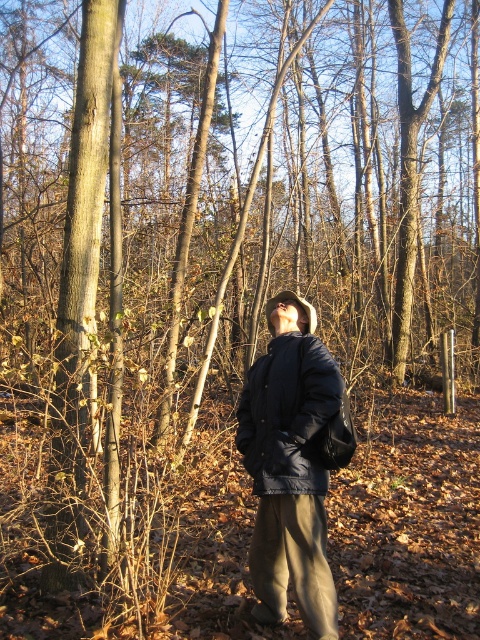
Who is lower down, matte black jacket at center or smooth brown bark at center?

matte black jacket at center is below.

Does matte black jacket at center have a greater height compared to smooth brown bark at center?

No, matte black jacket at center is not taller than smooth brown bark at center.

Describe the element at coordinates (289, 465) in the screenshot. The height and width of the screenshot is (640, 480). I see `matte black jacket at center` at that location.

I want to click on matte black jacket at center, so click(x=289, y=465).

Is smooth brown bark at center in front of navy blue quilted jacket at center?

No, it is not.

Does smooth brown bark at center appear over navy blue quilted jacket at center?

Indeed, smooth brown bark at center is positioned over navy blue quilted jacket at center.

Is point (59, 481) in front of point (300, 344)?

That is False.

What are the coordinates of `smooth brown bark at center` in the screenshot? It's located at (80, 291).

Which is above, matte black jacket at center or navy blue quilted jacket at center?

navy blue quilted jacket at center

Between point (317, 570) and point (290, 480), which one is positioned behind?

Point (290, 480)

The width and height of the screenshot is (480, 640). What do you see at coordinates (289, 465) in the screenshot?
I see `matte black jacket at center` at bounding box center [289, 465].

Identify the location of matte black jacket at center. The image size is (480, 640). (289, 465).